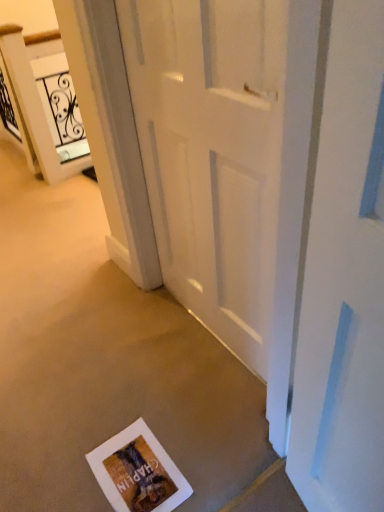
Question: Looking at the image, does white matte door at center seem bigger or smaller compared to matte paper postcard at lower center?

Choices:
 (A) small
 (B) big

Answer: (B)

Question: Is white matte door at center to the left or to the right of matte paper postcard at lower center in the image?

Choices:
 (A) left
 (B) right

Answer: (B)

Question: Which of these objects is positioned farthest from the matte paper postcard at lower center?

Choices:
 (A) white glossy elevator at upper left
 (B) white matte door at center

Answer: (A)

Question: Which object is positioned farthest from the white matte door at center?

Choices:
 (A) matte paper postcard at lower center
 (B) white glossy elevator at upper left

Answer: (B)